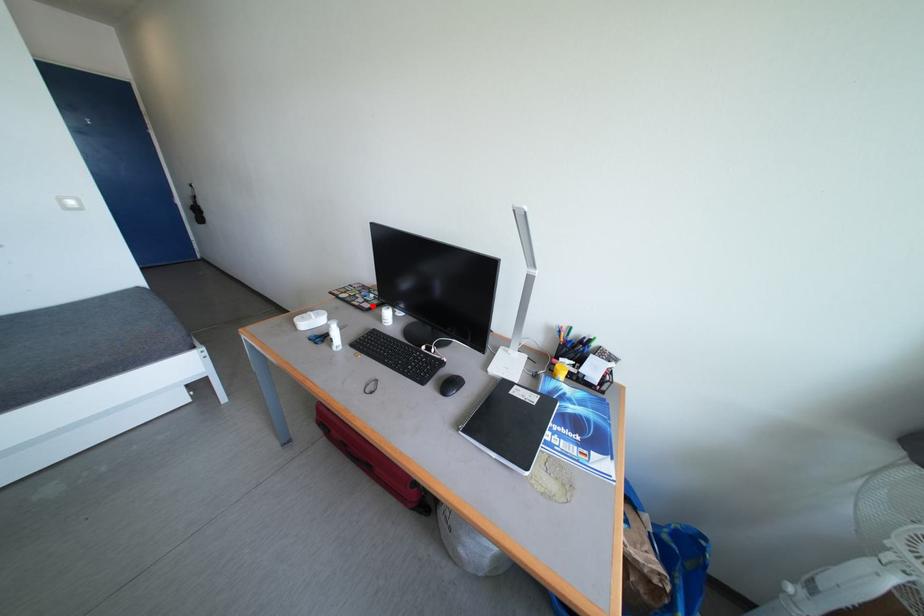
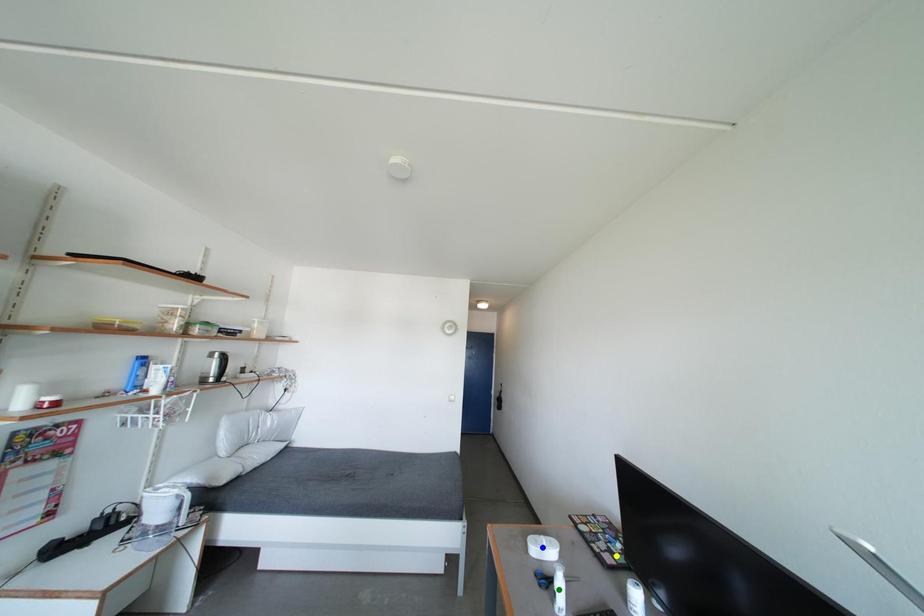
Question: I am providing you with two images of the same scene from different viewpoints. A red point is marked on the first image. You are given multiple points on the second image. Which point in image 2 is actually the same real-world point as the red point in image 1?

Choices:
 (A) green point
 (B) blue point
 (C) yellow point

Answer: (C)